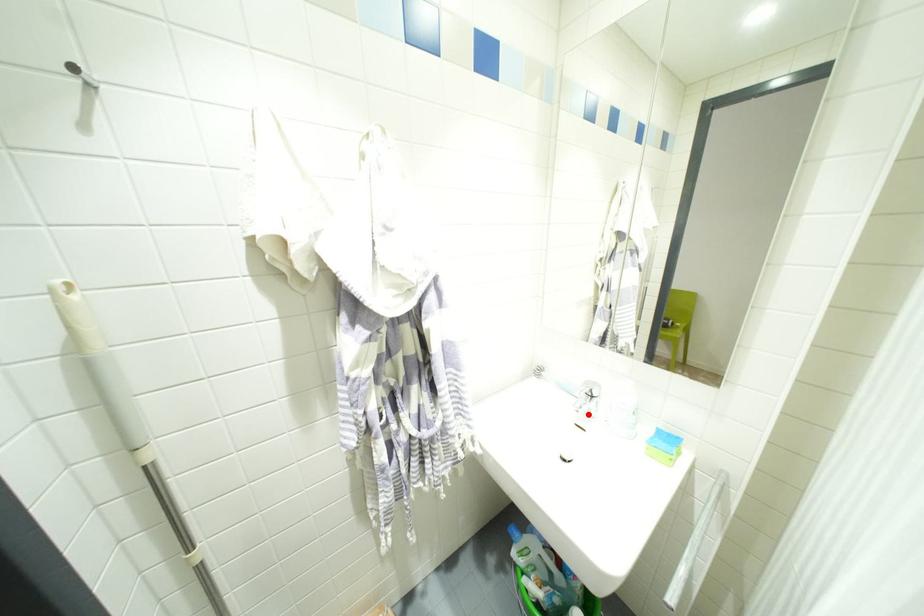
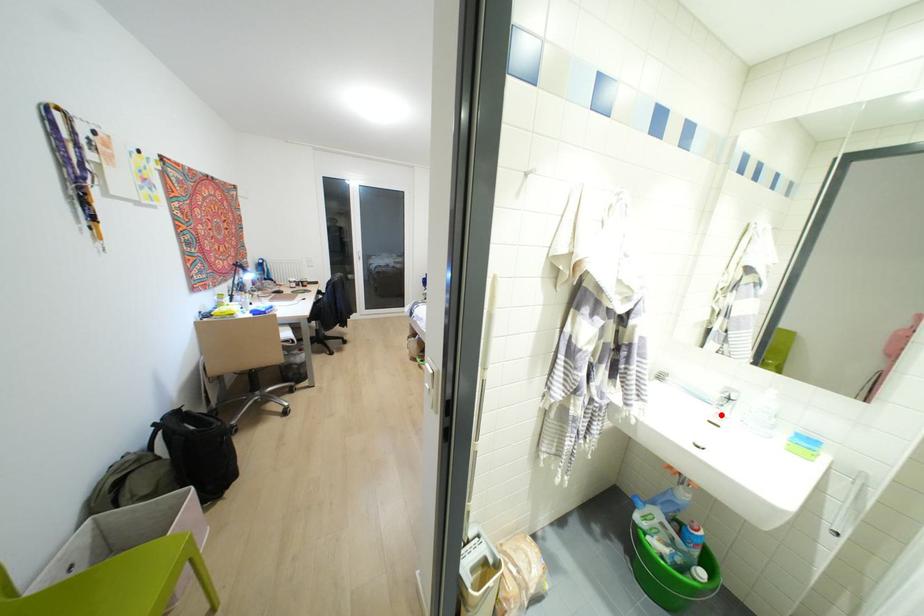
I am providing you with two images of the same scene from different viewpoints. A red point is marked on the first image and another point is marked on the second image. Is the marked point in image1 the same physical position as the marked point in image2?

Yes